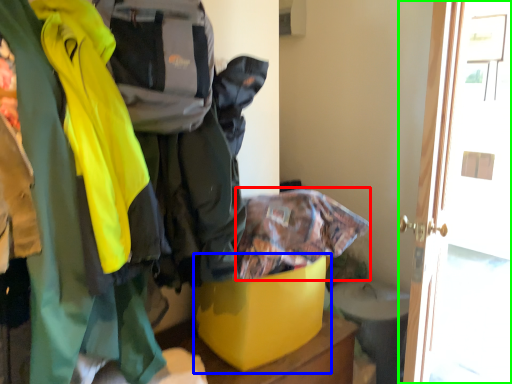
Question: Based on their relative distances, which object is farther from cloak (highlighted by a red box)? Choose from storage box (highlighted by a blue box) and door (highlighted by a green box).

Choices:
 (A) storage box
 (B) door

Answer: (B)